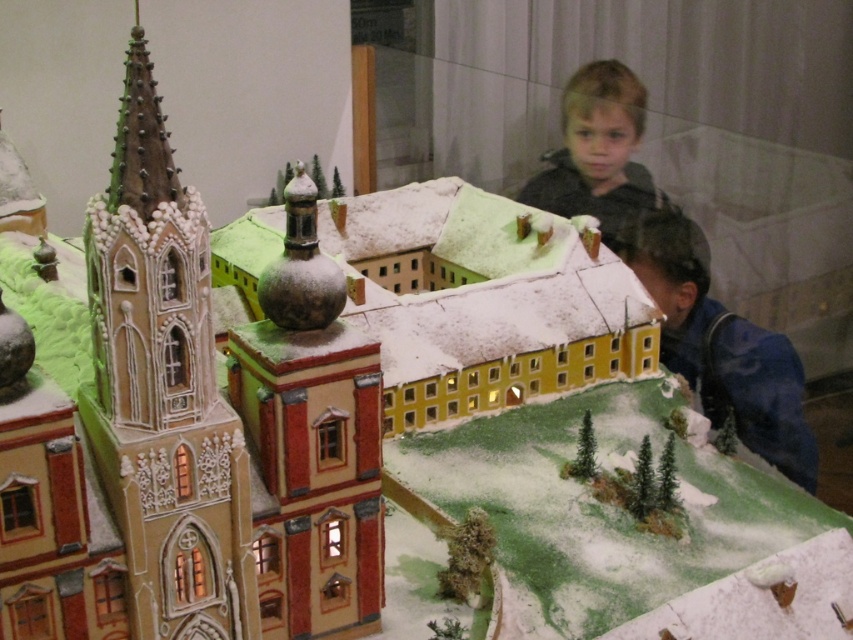
Can you confirm if blue fabric jacket at lower right is wider than blonde hair boy at upper right?

Indeed, blue fabric jacket at lower right has a greater width compared to blonde hair boy at upper right.

Who is higher up, blue fabric jacket at lower right or blonde hair boy at upper right?

blonde hair boy at upper right is above.

What do you see at coordinates (722, 346) in the screenshot? I see `blue fabric jacket at lower right` at bounding box center [722, 346].

What are the coordinates of `blue fabric jacket at lower right` in the screenshot? It's located at (722, 346).